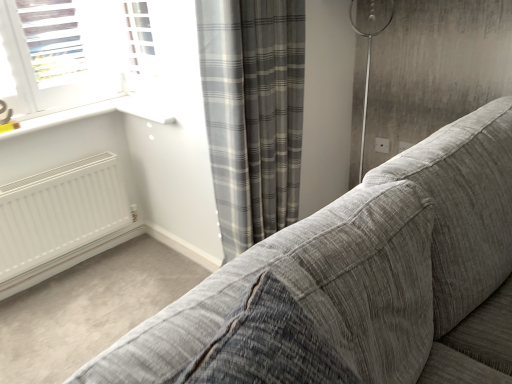
Question: Is textured gray fabric couch at center to the right of matte gray outlet at upper center from the viewer's perspective?

Choices:
 (A) no
 (B) yes

Answer: (A)

Question: Considering the relative sizes of textured gray fabric couch at center and matte gray outlet at upper center in the image provided, is textured gray fabric couch at center bigger than matte gray outlet at upper center?

Choices:
 (A) no
 (B) yes

Answer: (B)

Question: Is textured gray fabric couch at center shorter than matte gray outlet at upper center?

Choices:
 (A) yes
 (B) no

Answer: (B)

Question: Can you confirm if textured gray fabric couch at center is wider than matte gray outlet at upper center?

Choices:
 (A) no
 (B) yes

Answer: (B)

Question: From the image's perspective, would you say textured gray fabric couch at center is shown under matte gray outlet at upper center?

Choices:
 (A) no
 (B) yes

Answer: (B)

Question: Would you say textured gray fabric couch at center is to the left or to the right of gray plaid curtain at center in the picture?

Choices:
 (A) left
 (B) right

Answer: (A)

Question: Looking at their shapes, would you say textured gray fabric couch at center is wider or thinner than gray plaid curtain at center?

Choices:
 (A) thin
 (B) wide

Answer: (B)

Question: Is textured gray fabric couch at center bigger or smaller than gray plaid curtain at center?

Choices:
 (A) small
 (B) big

Answer: (A)

Question: From a real-world perspective, is textured gray fabric couch at center positioned above or below gray plaid curtain at center?

Choices:
 (A) below
 (B) above

Answer: (B)

Question: From their relative heights in the image, would you say matte gray outlet at upper center is taller or shorter than gray plaid curtain at center?

Choices:
 (A) tall
 (B) short

Answer: (B)

Question: Looking at their shapes, would you say matte gray outlet at upper center is wider or thinner than gray plaid curtain at center?

Choices:
 (A) wide
 (B) thin

Answer: (B)

Question: From the image's perspective, relative to gray plaid curtain at center, is matte gray outlet at upper center above or below?

Choices:
 (A) below
 (B) above

Answer: (B)

Question: In the image, is matte gray outlet at upper center on the left side or the right side of gray plaid curtain at center?

Choices:
 (A) right
 (B) left

Answer: (A)

Question: Looking at their shapes, would you say textured gray fabric couch at center is wider or thinner than matte gray outlet at upper center?

Choices:
 (A) wide
 (B) thin

Answer: (A)

Question: Considering their positions, is textured gray fabric couch at center located in front of or behind matte gray outlet at upper center?

Choices:
 (A) behind
 (B) front

Answer: (B)